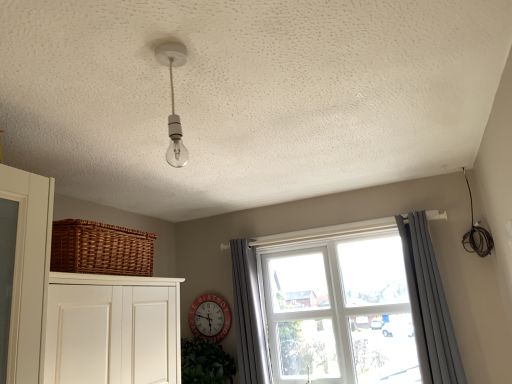
Question: Does gray fabric curtain at window, the first curtain from the left, lie in front of clear glass window at center?

Choices:
 (A) yes
 (B) no

Answer: (B)

Question: From a real-world perspective, is gray fabric curtain at window, acting as the second curtain starting from the right, on clear glass window at center?

Choices:
 (A) no
 (B) yes

Answer: (B)

Question: Is gray fabric curtain at window, acting as the second curtain starting from the right, to the left of clear glass window at center from the viewer's perspective?

Choices:
 (A) no
 (B) yes

Answer: (B)

Question: From a real-world perspective, is gray fabric curtain at window, acting as the second curtain starting from the right, below clear glass window at center?

Choices:
 (A) yes
 (B) no

Answer: (B)

Question: Considering the relative sizes of gray fabric curtain at window, acting as the second curtain starting from the right, and clear glass window at center in the image provided, is gray fabric curtain at window, acting as the second curtain starting from the right, bigger than clear glass window at center?

Choices:
 (A) yes
 (B) no

Answer: (B)

Question: Is clear glass window at center to the left or to the right of clear glass bulb at center in the image?

Choices:
 (A) right
 (B) left

Answer: (A)

Question: Considering the positions of point (323, 352) and point (181, 137), is point (323, 352) closer or farther from the camera than point (181, 137)?

Choices:
 (A) farther
 (B) closer

Answer: (A)

Question: Choose the correct answer: Is clear glass window at center inside clear glass bulb at center or outside it?

Choices:
 (A) inside
 (B) outside

Answer: (B)

Question: From a real-world perspective, is clear glass window at center positioned above or below clear glass bulb at center?

Choices:
 (A) above
 (B) below

Answer: (B)

Question: Considering their positions, is gray fabric curtain at right, the first curtain from the right, located in front of or behind red metallic clock at center?

Choices:
 (A) behind
 (B) front

Answer: (B)

Question: From the image's perspective, is gray fabric curtain at right, the 2th curtain positioned from the left, located above or below red metallic clock at center?

Choices:
 (A) above
 (B) below

Answer: (A)

Question: Is gray fabric curtain at right, the 2th curtain positioned from the left, wider or thinner than red metallic clock at center?

Choices:
 (A) thin
 (B) wide

Answer: (B)

Question: From their relative heights in the image, would you say gray fabric curtain at right, the first curtain from the right, is taller or shorter than red metallic clock at center?

Choices:
 (A) tall
 (B) short

Answer: (A)

Question: Is gray fabric curtain at window, acting as the second curtain starting from the right, to the left or to the right of gray fabric curtain at right, the 2th curtain positioned from the left, in the image?

Choices:
 (A) left
 (B) right

Answer: (A)

Question: In terms of size, does gray fabric curtain at window, the first curtain from the left, appear bigger or smaller than gray fabric curtain at right, the 2th curtain positioned from the left?

Choices:
 (A) small
 (B) big

Answer: (A)